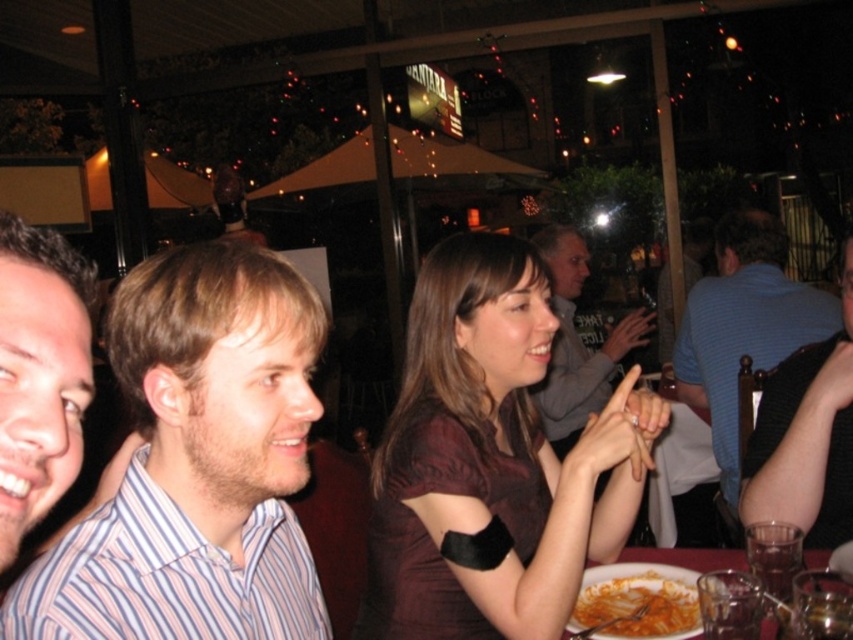
You are a photographer taking a picture of the scene. You notice the striped shirt at left and the tomato sauce pasta at lower right. Which object should you focus on first if you want to capture both in the same frame without moving the camera?

The striped shirt at left is taller than the tomato sauce pasta at lower right, so focusing on the striped shirt at left first would ensure both objects are in frame since it occupies more vertical space.

You are a photographer at the event and want to take a photo of both the blue striped shirt at right and the white glossy plate at lower center. Which object should you focus on first to ensure both are in clear focus?

The blue striped shirt at right is further to the viewer than the white glossy plate at lower center, so focus on the blue striped shirt at right first to ensure both are in clear focus.